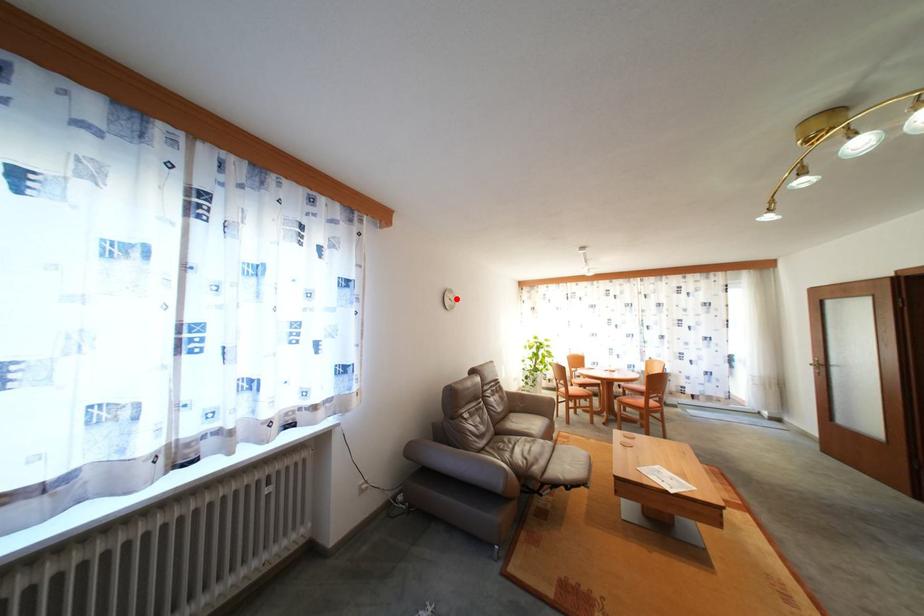
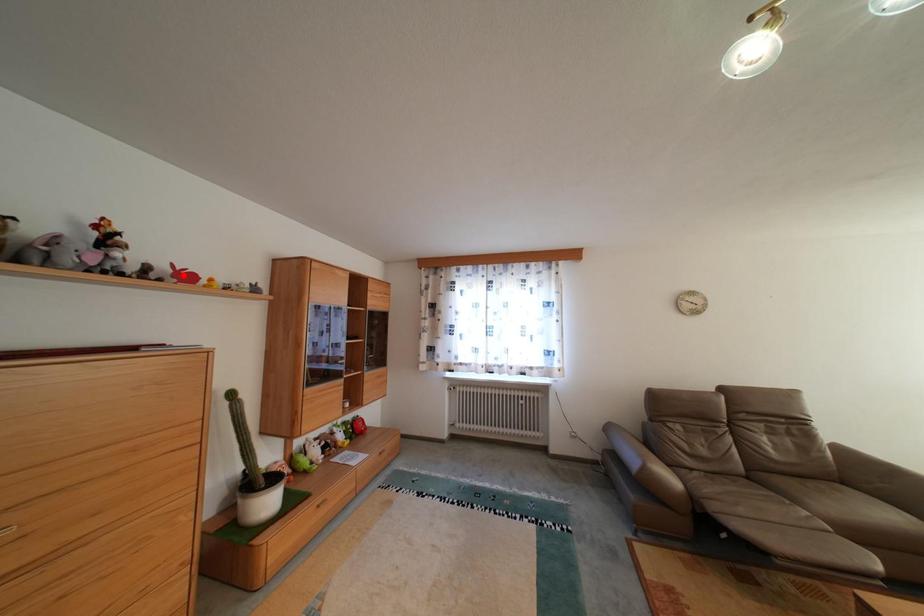
I am providing you with two images of the same scene from different viewpoints. A red point is marked on the first image and another point is marked on the second image. Are the points marked in image1 and image2 representing the same 3D position?

No